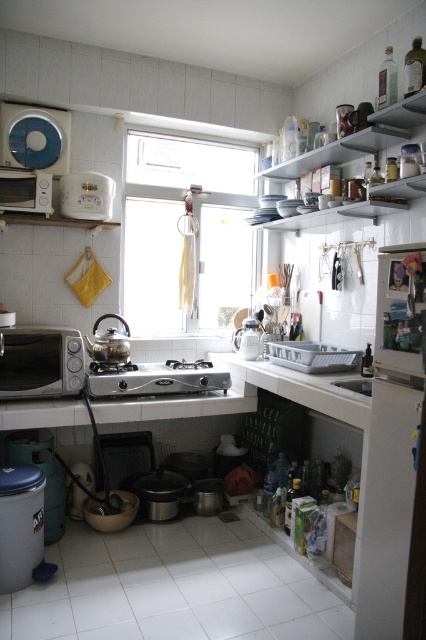
Who is positioned more to the right, satin silver microwave at lower left or silver metallic stove at center?

silver metallic stove at center is more to the right.

Between point (49, 346) and point (123, 390), which one is positioned in front?

Point (49, 346) is in front.

Between point (37, 326) and point (221, 372), which one is positioned behind?

The point (221, 372) is behind.

Where is `satin silver microwave at lower left`? satin silver microwave at lower left is located at coordinates (40, 362).

Which is below, metallic silver dishes at upper right or silver metallic stove at center?

Positioned lower is silver metallic stove at center.

Where is `metallic silver dishes at upper right`? Image resolution: width=426 pixels, height=640 pixels. metallic silver dishes at upper right is located at coordinates (354, 141).

Who is more distant from viewer, (408, 129) or (89, 388)?

The point (89, 388) is more distant.

You are a GUI agent. You are given a task and a screenshot of the screen. Output one action in this format:
    pyautogui.click(x=<x>, y=<y>)
    Task: Click on the metallic silver dishes at upper right
    This screenshot has height=640, width=426.
    Given the screenshot: What is the action you would take?
    pyautogui.click(x=354, y=141)

Who is higher up, satin silver microwave at lower left or metallic silver dishes at upper right?

metallic silver dishes at upper right is above.

Based on the photo, is the position of satin silver microwave at lower left more distant than that of metallic silver dishes at upper right?

Yes, it is behind metallic silver dishes at upper right.

The height and width of the screenshot is (640, 426). What are the coordinates of `satin silver microwave at lower left` in the screenshot? It's located at (40, 362).